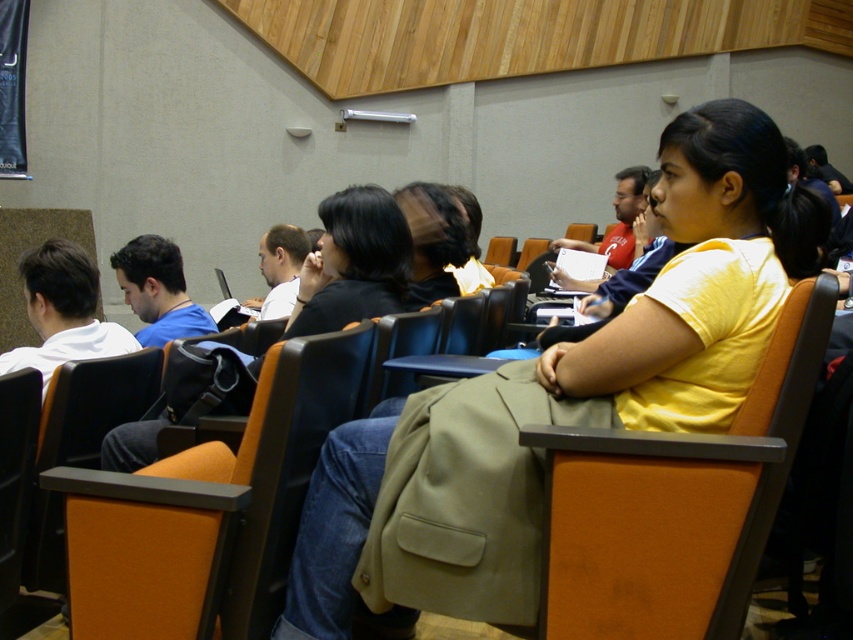
You are sitting in the orange leather chair at center and want to see the person in the yellow matte shirt at center. Can you see them without moving your head?

The orange leather chair at center is behind the yellow matte shirt at center, so you can see them by looking forward.

You are sitting in the orange leather chair at center and want to hand a document to someone behind you. Can you easily reach the matte black jacket at center to pass the document?

The orange leather chair at center is in front of the matte black jacket at center, so you can easily reach behind to pass the document to the person wearing the matte black jacket at center.